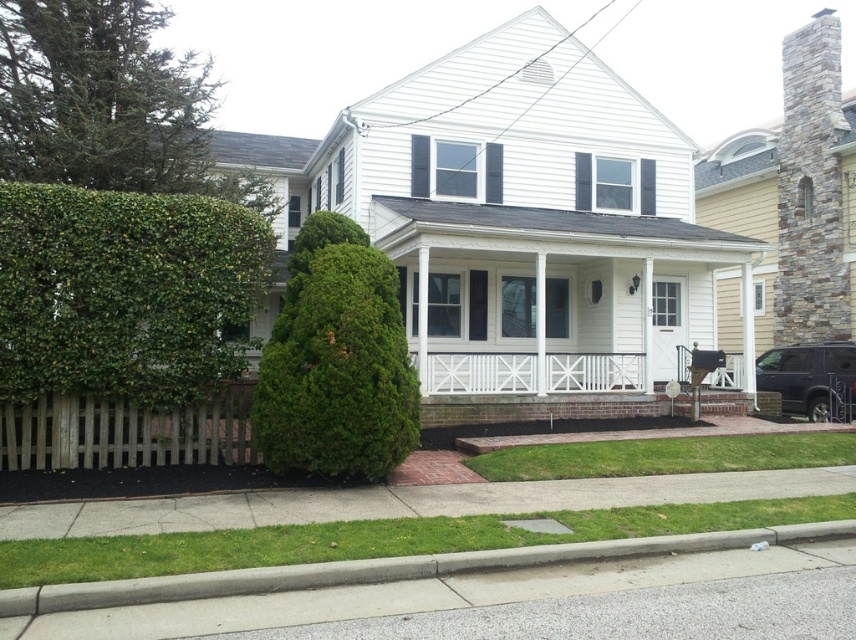
You are standing at the front entrance of the house and looking towards the wooden picket fence. There is a point marked at coordinates (336, 362). What object is located at that point?

The point at (336, 362) is where the green textured hedge at center is located.

You are a gardener planning to install a new sprinkler system. The sprinkler has a maximum range of 4 meters. If you place it at the gray concrete curb at lower center, will it reach the green leafy hedge at left?

The green leafy hedge at left is 4.21 meters from the gray concrete curb at lower center. Since the sprinkler has a maximum range of 4 meters, it will not reach the hedge.

You are a gardener assessing the front yard of the house. You need to determine which object, the green leafy hedge at left or the gray concrete curb at lower center, requires more frequent trimming based on their height. Which one do you think needs more attention?

The green leafy hedge at left is taller than the gray concrete curb at lower center, so it likely requires more frequent trimming to maintain its shape and size.